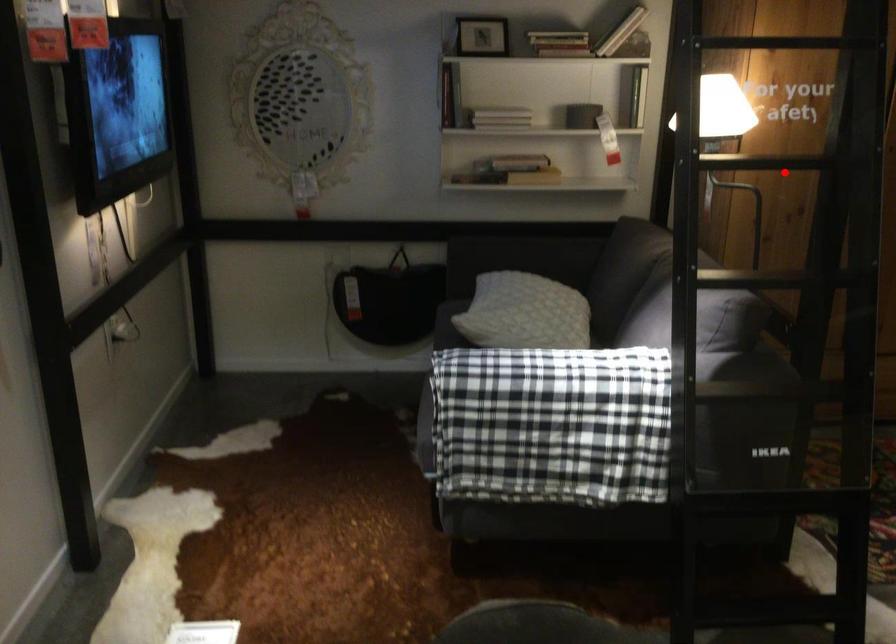
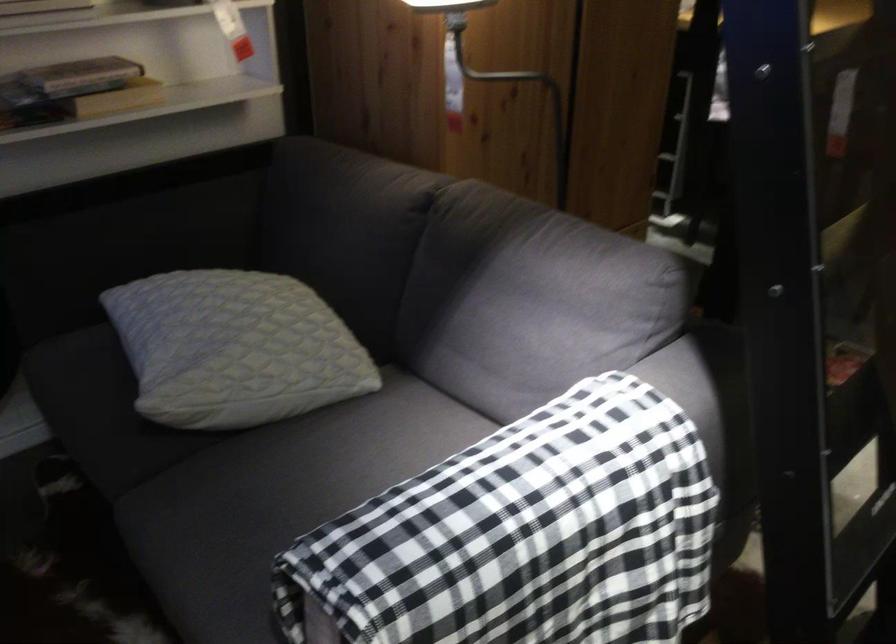
Locate, in the second image, the point that corresponds to the highlighted location in the first image.

(500, 71)